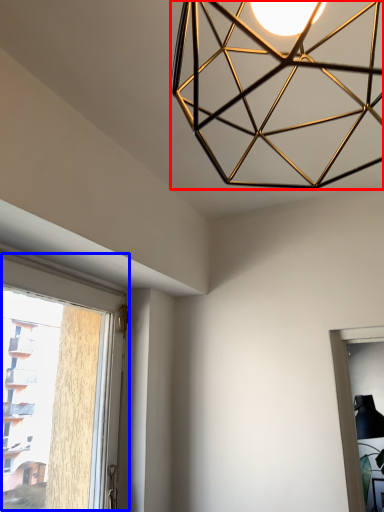
Question: Which object appears closest to the camera in this image, lamp (highlighted by a red box) or window (highlighted by a blue box)?

Choices:
 (A) lamp
 (B) window

Answer: (A)